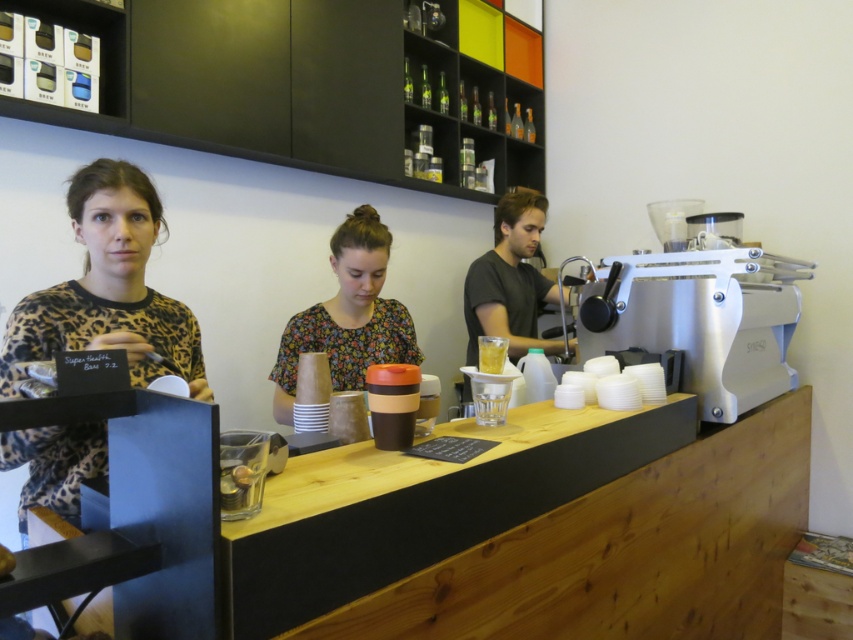
Where is the floral fabric shirt at center located in the image?

The floral fabric shirt at center is located at point (347,316).

You are a customer at the cafe and want to grab the translucent plastic cup at center to order a drink. However, the floral fabric shirt at center is blocking your way. Can you reach the cup without moving the shirt?

The translucent plastic cup at center is behind the floral fabric shirt at center, so you cannot reach it without moving the shirt.